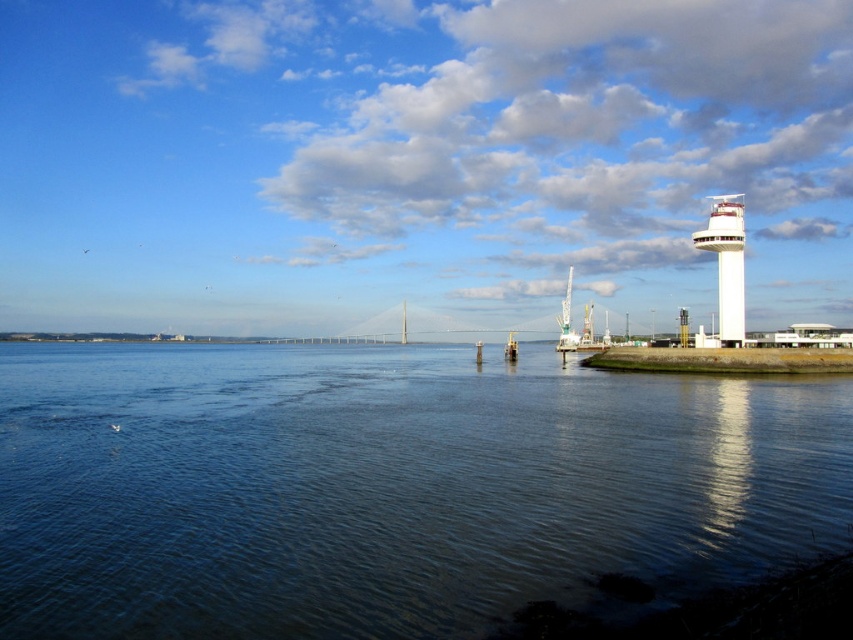
Is dark blue water at center to the right of white smooth tower at right from the viewer's perspective?

No, dark blue water at center is not to the right of white smooth tower at right.

Based on the photo, can you confirm if dark blue water at center is positioned above white smooth tower at right?

Actually, dark blue water at center is below white smooth tower at right.

Is point (148, 372) positioned before point (735, 228)?

No, it is not.

You are a GUI agent. You are given a task and a screenshot of the screen. Output one action in this format:
    pyautogui.click(x=<x>, y=<y>)
    Task: Click on the dark blue water at center
    Image resolution: width=853 pixels, height=640 pixels.
    Given the screenshot: What is the action you would take?
    pyautogui.click(x=387, y=486)

Can you confirm if dark blue water at center is positioned to the left of white metallic crane at center-right?

Correct, you'll find dark blue water at center to the left of white metallic crane at center-right.

Can you confirm if dark blue water at center is taller than white metallic crane at center-right?

In fact, dark blue water at center may be shorter than white metallic crane at center-right.

This screenshot has width=853, height=640. Find the location of `dark blue water at center`. dark blue water at center is located at coordinates (387, 486).

Locate an element on the screen. Image resolution: width=853 pixels, height=640 pixels. dark blue water at center is located at coordinates (387, 486).

Is point (740, 221) less distant than point (589, 321)?

Yes.

Is white smooth tower at right shorter than white metallic crane at center-right?

Yes, white smooth tower at right is shorter than white metallic crane at center-right.

Where is `white smooth tower at right`? The height and width of the screenshot is (640, 853). white smooth tower at right is located at coordinates (727, 260).

Identify the location of white smooth tower at right. This screenshot has width=853, height=640. (727, 260).